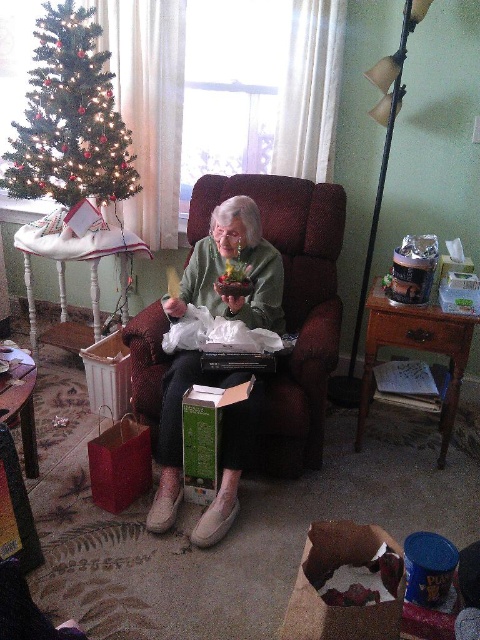
You are a photographer trying to capture a closeup of the gift box. You notice two points in the scene marked as point 1 at coordinates point [392,540] and point 2 at coordinates point [66,259]. Which point should you focus on to ensure the gift box is in sharp focus?

Point 1 at coordinates point [392,540] is closer to the camera, so focusing on that point will ensure the gift box is in sharp focus.